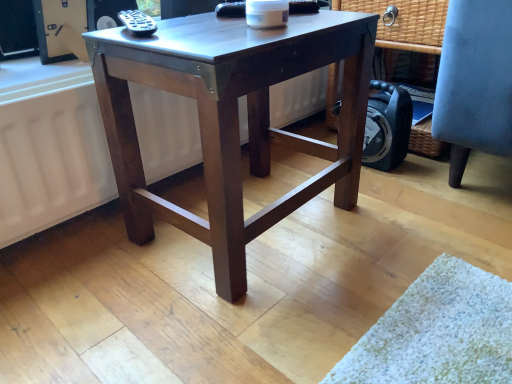
Identify the location of free point below dark wood table at center (from a real-world perspective). (258, 207).